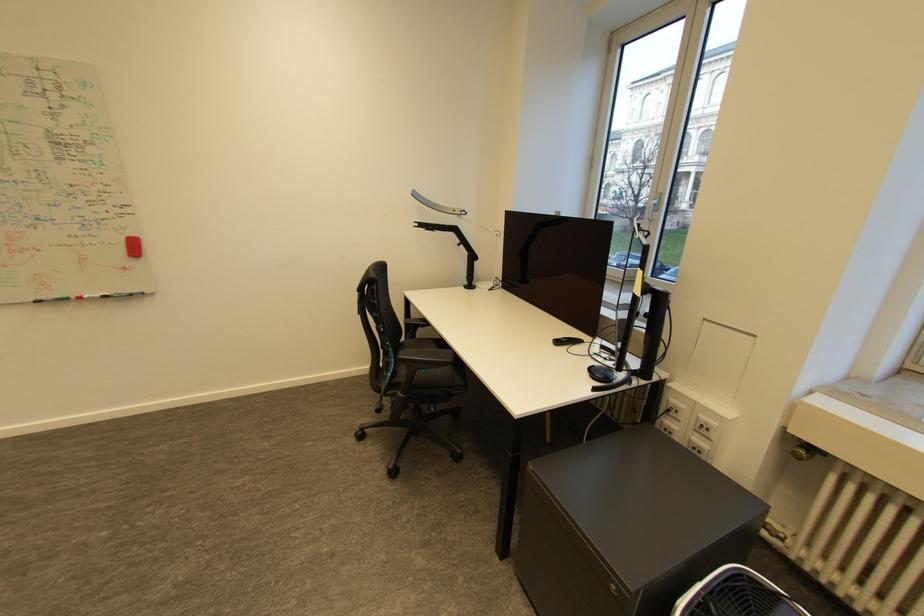
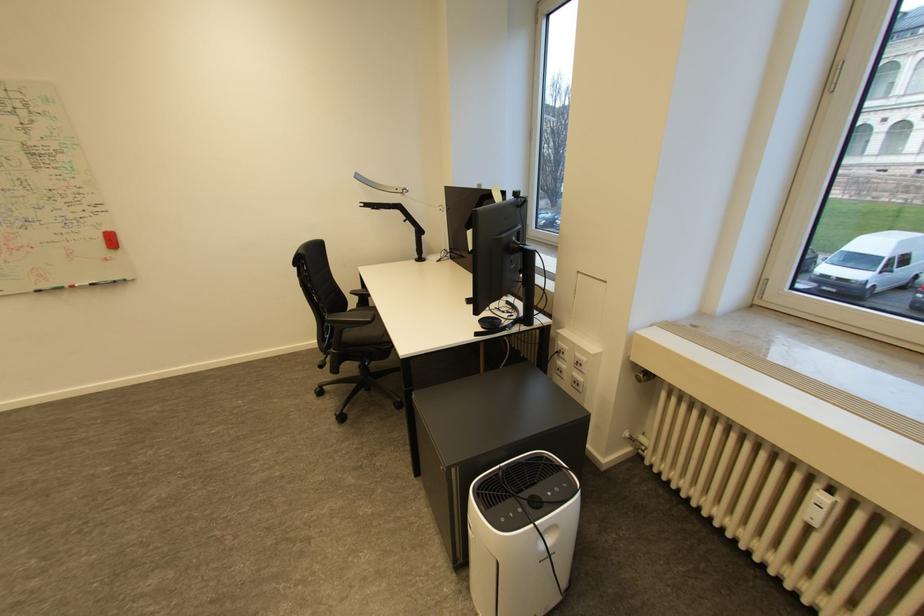
In the second image, find the point that corresponds to pixel 91 297 in the first image.

(83, 286)